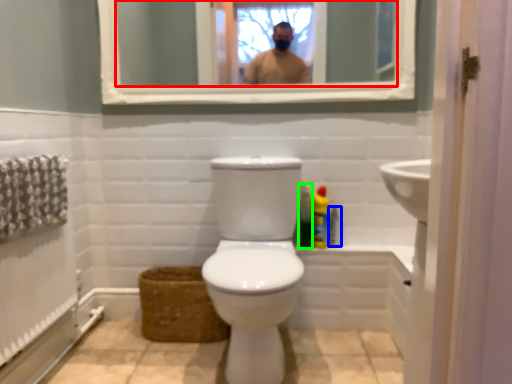
Question: Which object is positioned closest to mirror (highlighted by a red box)? Select from toiletry (highlighted by a blue box) and cleaning product (highlighted by a green box).

Choices:
 (A) toiletry
 (B) cleaning product

Answer: (B)